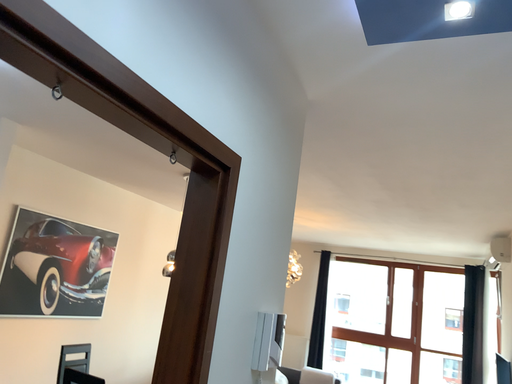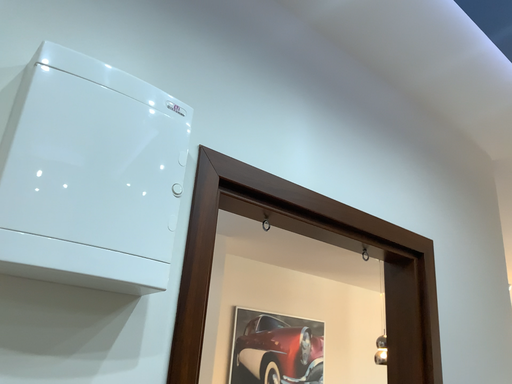
Question: Which way did the camera rotate in the video?

Choices:
 (A) rotated upward
 (B) rotated downward

Answer: (A)